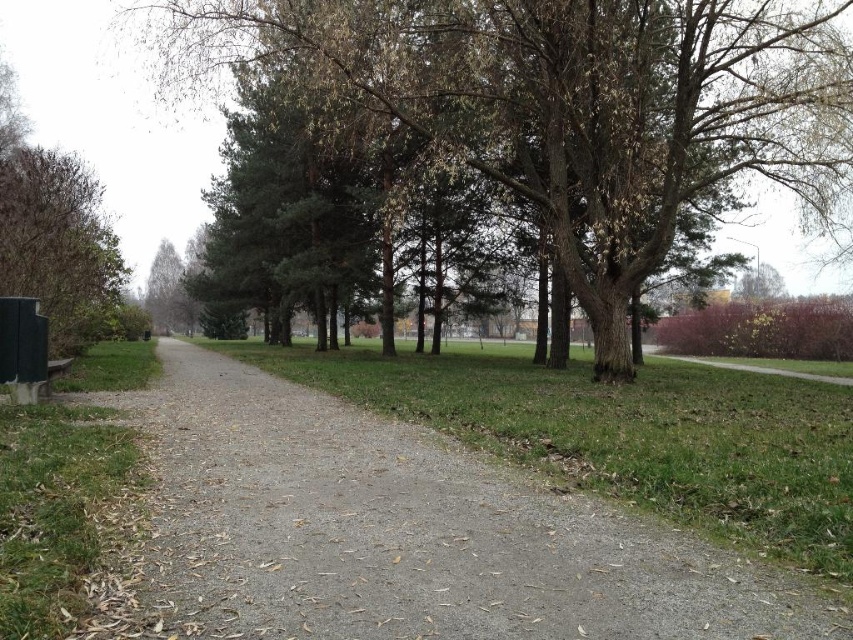
Question: From the image, what is the correct spatial relationship of green matte tree at upper left in relation to brown matte tree at upper right?

Choices:
 (A) below
 (B) above

Answer: (B)

Question: Is green matte tree at left smaller than brown matte tree at upper right?

Choices:
 (A) yes
 (B) no

Answer: (B)

Question: Which of these objects is positioned closest to the green grass at center?

Choices:
 (A) brown textured tree at center
 (B) green matte tree at left
 (C) brown matte tree at upper right
 (D) green matte tree at upper left

Answer: (A)

Question: Can you confirm if brown textured tree at center is bigger than green grass at center?

Choices:
 (A) no
 (B) yes

Answer: (B)

Question: Which point appears farthest from the camera in this image?

Choices:
 (A) 741,280
 (B) 846,552
 (C) 1,225
 (D) 173,288

Answer: (D)

Question: Among these objects, which one is farthest from the camera?

Choices:
 (A) brown textured tree at center
 (B) green grass at center
 (C) green matte tree at left
 (D) brown matte tree at upper right

Answer: (D)